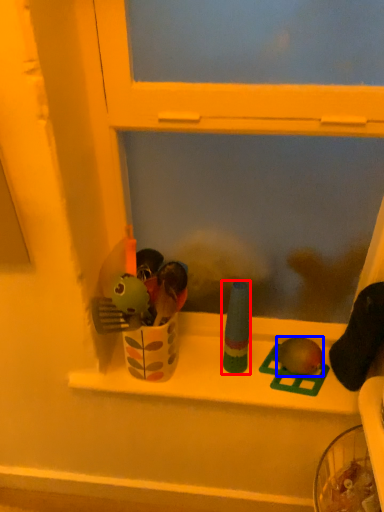
Question: Which of the following is the farthest to the observer, toy (highlighted by a red box) or toy (highlighted by a blue box)?

Choices:
 (A) toy
 (B) toy

Answer: (B)